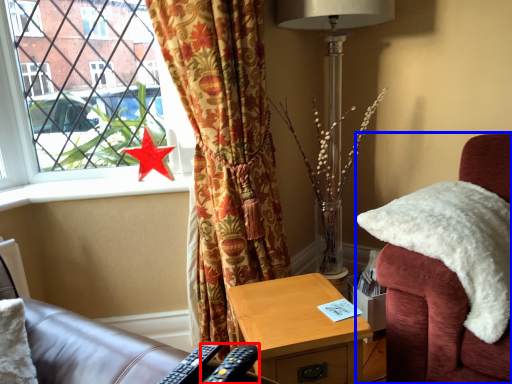
Question: Which object is further to the camera taking this photo, remote control (highlighted by a red box) or chair (highlighted by a blue box)?

Choices:
 (A) remote control
 (B) chair

Answer: (B)